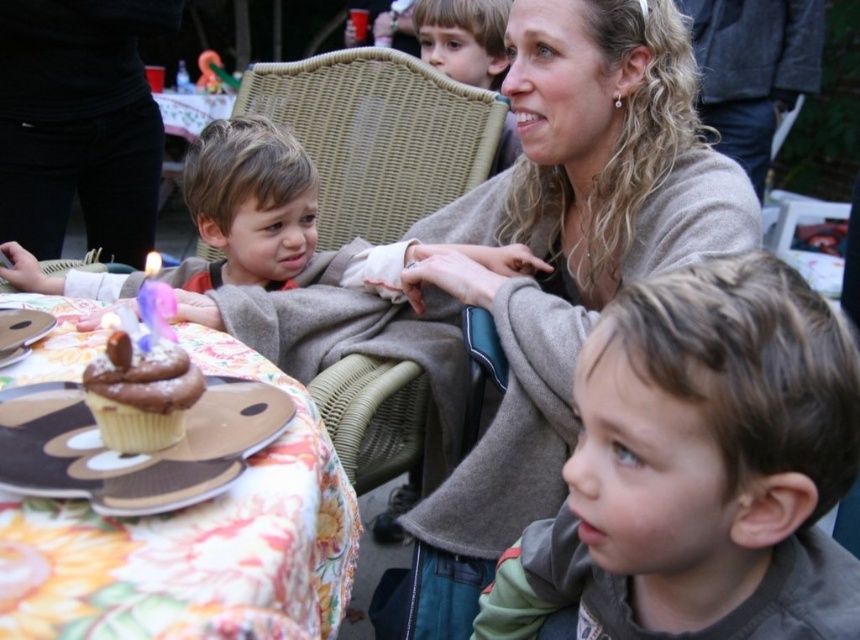
Between smooth beige sweater at upper center and chocolate cupcake at lower left, which one is positioned higher?

smooth beige sweater at upper center

Where is `smooth beige sweater at upper center`? Image resolution: width=860 pixels, height=640 pixels. smooth beige sweater at upper center is located at coordinates (564, 268).

Which is more to the left, chocolate matte cupcake at lower left or purple wax candle at center?

Positioned to the left is purple wax candle at center.

Is chocolate matte cupcake at lower left positioned at the back of purple wax candle at center?

No, chocolate matte cupcake at lower left is closer to the viewer.

What do you see at coordinates (140, 394) in the screenshot? Image resolution: width=860 pixels, height=640 pixels. I see `chocolate matte cupcake at lower left` at bounding box center [140, 394].

Locate an element on the screen. Image resolution: width=860 pixels, height=640 pixels. chocolate matte cupcake at lower left is located at coordinates (140, 394).

Consider the image. Who is more forward, (757, 225) or (150, 403)?

Point (150, 403)

Does smooth beige sweater at upper center appear under chocolate matte cupcake at lower left?

No.

Who is more distant from viewer, (582, 212) or (158, 378)?

Point (582, 212)

Locate an element on the screen. smooth beige sweater at upper center is located at coordinates (564, 268).